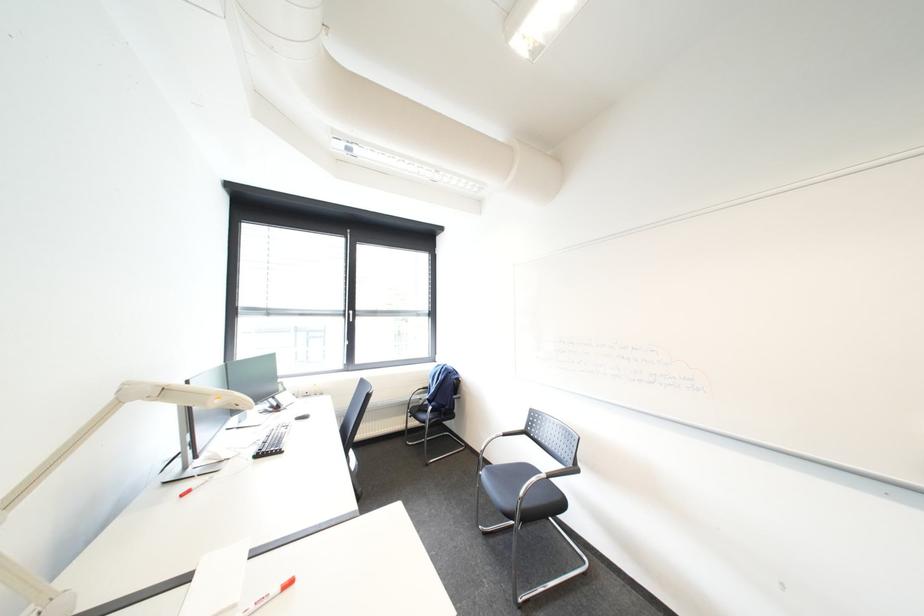
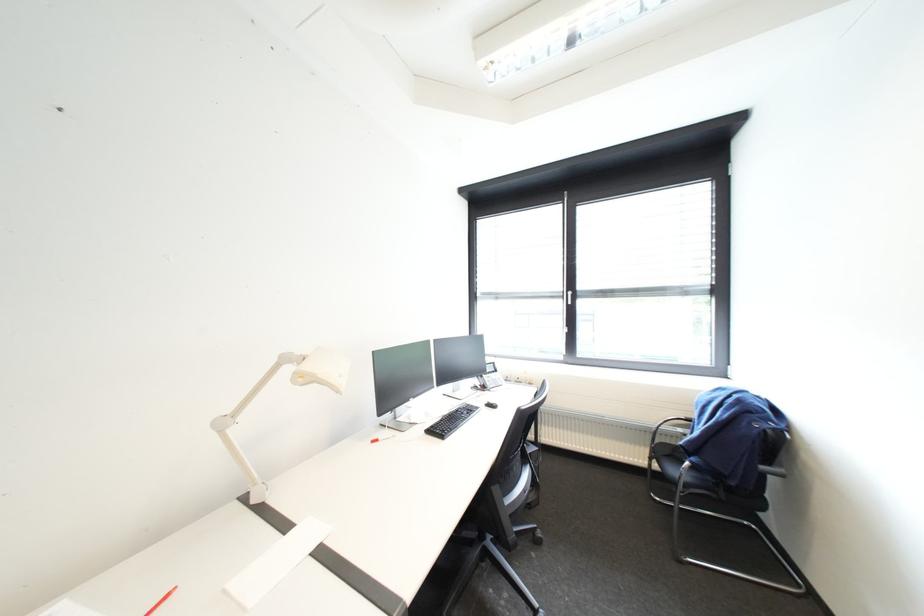
Question: How did the camera likely rotate?

Choices:
 (A) Left
 (B) Right
 (C) Up
 (D) Down

Answer: (A)